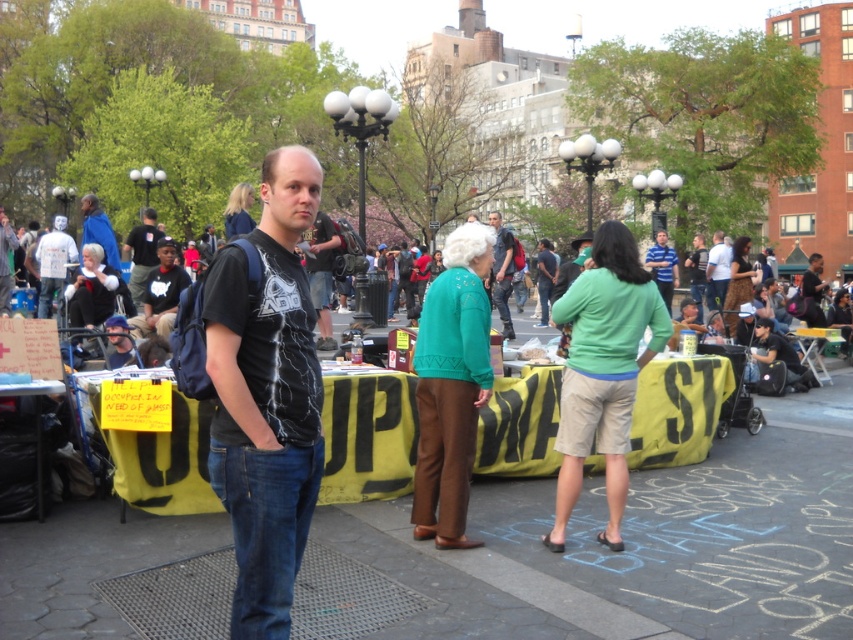
You are a photographer trying to capture a clear shot of the banner in the foreground. The dark blue backpack at center and the matte black backpack at center are blocking your view. Which backpack should you move to get a better angle?

You should move the dark blue backpack at center because it is larger and might be blocking more of the banner. Since it is larger than the matte black backpack at center, removing it could provide a clearer view of the banner.

You are a photographer trying to capture a clear shot of the matte black backpack at center and the dark blue backpack at center. Based on their positions, which backpack should you focus on first to ensure both are in frame?

The dark blue backpack at center is to the left of the matte black backpack at center, so you should focus on the matte black backpack at center first to ensure both are in frame.